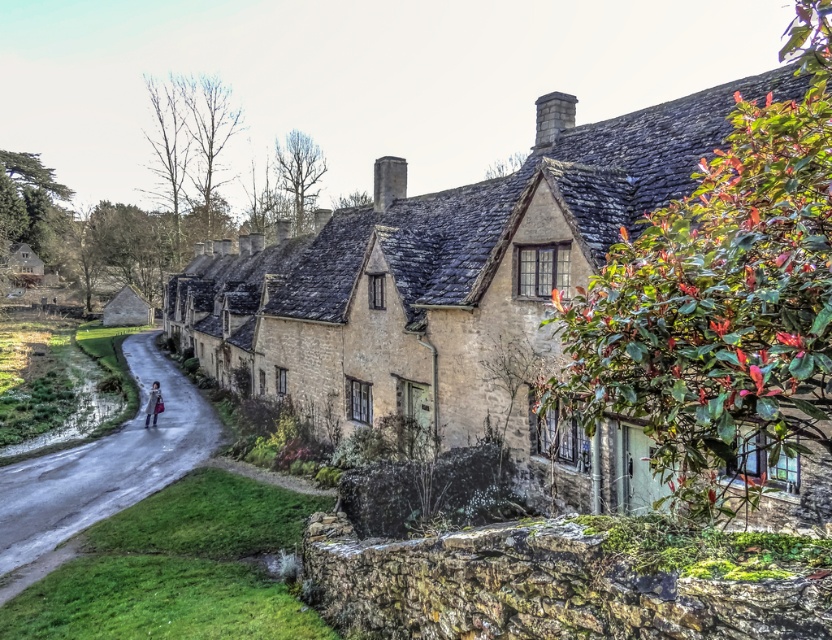
You are a traveler standing on the road and see the stone cottage at center and the matte pink coat at road center. Which object is bigger in size?

The stone cottage at center is larger in size than the matte pink coat at road center.

You are a tourist standing on the road and want to take a photo of the stone cottage at center without the matte pink coat at road center appearing in the frame. Is this possible based on their positions?

The stone cottage at center is above the matte pink coat at road center, so if you position yourself to aim the camera upwards towards the cottage while ensuring the lower part of the frame does not include the road area where the coat is, it should be possible to capture the cottage without the coat in the shot.